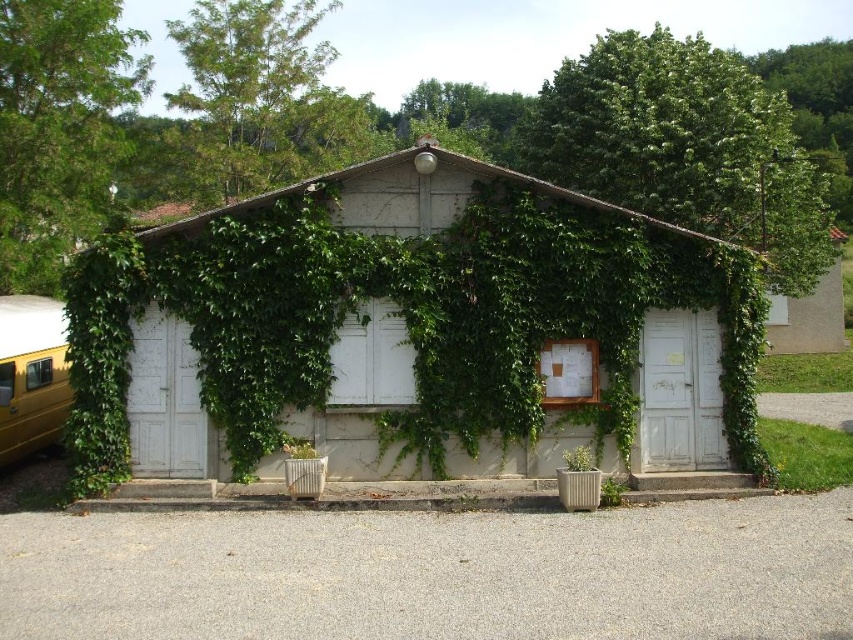
Is green ivy-covered hut at center below yellow matte school bus at left?

Yes, green ivy-covered hut at center is below yellow matte school bus at left.

At what (x,y) coordinates should I click in order to perform the action: click on green ivy-covered hut at center. Please return your answer as a coordinate pair (x, y). This screenshot has width=853, height=640. Looking at the image, I should click on (403, 316).